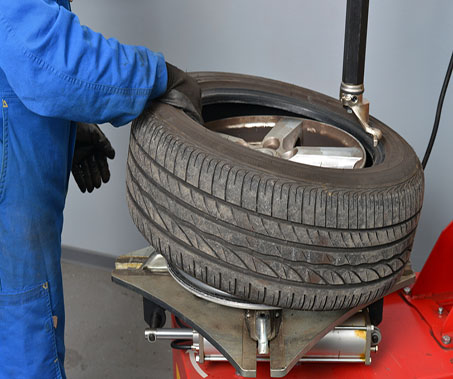
In order to click on cord in this screenshot , I will do `click(438, 110)`.